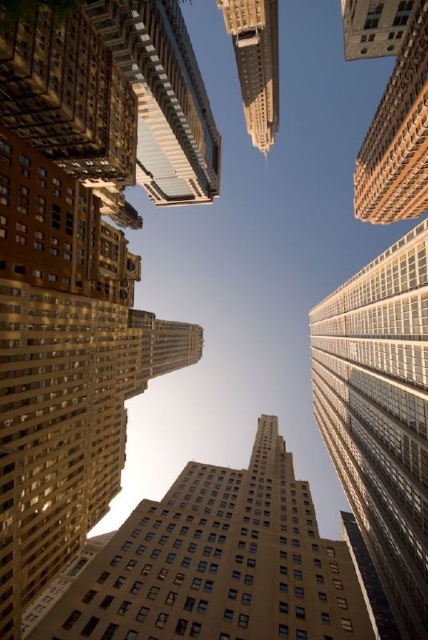
Question: Which object is positioned farthest from the gold textured building at upper left?

Choices:
 (A) glassy reflective skyscraper at center
 (B) gold glass skyscraper at upper right

Answer: (A)

Question: Does gold textured building at upper left have a lesser width compared to gold glass skyscraper at upper right?

Choices:
 (A) no
 (B) yes

Answer: (B)

Question: Which of the following is the farthest from the observer?

Choices:
 (A) tap(389, 198)
 (B) tap(113, 600)
 (C) tap(249, 90)
 (D) tap(202, 157)

Answer: (C)

Question: Is golden glass skyscraper at center wider than glassy reflective skyscraper at center?

Choices:
 (A) no
 (B) yes

Answer: (B)

Question: Observing the image, what is the correct spatial positioning of glassy reflective skyscraper at center in reference to gold glass skyscraper at upper right?

Choices:
 (A) right
 (B) left

Answer: (B)

Question: Which is nearer to the golden glass skyscraper at center?

Choices:
 (A) gold textured building at upper center
 (B) glassy reflective skyscraper at center
 (C) gold textured building at upper left
 (D) gold glass skyscraper at upper right

Answer: (B)